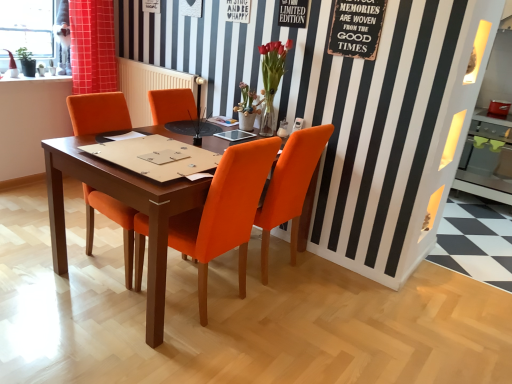
The width and height of the screenshot is (512, 384). What do you see at coordinates (225, 212) in the screenshot? I see `orange fabric chair at center, the 2th chair from the right` at bounding box center [225, 212].

Describe the element at coordinates (99, 113) in the screenshot. I see `orange leather chair at center, acting as the first chair starting from the left` at that location.

Identify the location of orange leather chair at center, acting as the first chair starting from the left. (99, 113).

Describe the element at coordinates (290, 187) in the screenshot. This screenshot has width=512, height=384. I see `orange fabric chair at center, the third chair in the left-to-right sequence` at that location.

What do you see at coordinates (271, 80) in the screenshot? I see `matte glass vase at upper center, which is counted as the 1th flower, starting from the right` at bounding box center [271, 80].

This screenshot has width=512, height=384. Describe the element at coordinates (248, 101) in the screenshot. I see `matte orange vase at center, which ranks as the first flower in left-to-right order` at that location.

Describe the element at coordinates (92, 46) in the screenshot. This screenshot has height=384, width=512. I see `orange fabric curtain at upper left` at that location.

The width and height of the screenshot is (512, 384). What do you see at coordinates (104, 184) in the screenshot?
I see `wooden table at center` at bounding box center [104, 184].

Identify the location of orange fabric chair at center, the 2th chair from the right. This screenshot has width=512, height=384. (225, 212).

Does wooden table at center have a greater height compared to limited edition paper at upper center?

Yes, wooden table at center is taller than limited edition paper at upper center.

From a real-world perspective, does wooden table at center sit lower than limited edition paper at upper center?

Indeed, from a real-world perspective, wooden table at center is positioned beneath limited edition paper at upper center.

Which is less distant, (54, 216) or (293, 25)?

Point (54, 216) is positioned closer to the camera compared to point (293, 25).

From a real-world perspective, is orange fabric chair at center, the 2th chair from the right, over orange fabric curtain at upper left?

No, from a real-world perspective, orange fabric chair at center, the 2th chair from the right, is not above orange fabric curtain at upper left.

Is orange fabric chair at center, the 2th chair from the right, positioned far away from orange fabric curtain at upper left?

orange fabric chair at center, the 2th chair from the right, is far away from orange fabric curtain at upper left.

I want to click on curtain on the left of orange fabric chair at center, the 2th chair from the right, so click(x=92, y=46).

Considering the sizes of orange fabric chair at center, positioned as the 2th chair in left-to-right order, and orange fabric curtain at upper left in the image, is orange fabric chair at center, positioned as the 2th chair in left-to-right order, bigger or smaller than orange fabric curtain at upper left?

Considering their sizes, orange fabric chair at center, positioned as the 2th chair in left-to-right order, takes up more space than orange fabric curtain at upper left.

You are a GUI agent. You are given a task and a screenshot of the screen. Output one action in this format:
    pyautogui.click(x=<x>, y=<y>)
    Task: Click on the curtain located underneath the matte glass vase at upper center, which is counted as the 1th flower, starting from the right (from a real-world perspective)
    The width and height of the screenshot is (512, 384).
    Given the screenshot: What is the action you would take?
    pyautogui.click(x=92, y=46)

From the image's perspective, is orange fabric curtain at upper left positioned above or below matte glass vase at upper center, which is counted as the 1th flower, starting from the right?

Clearly, from the image's perspective, orange fabric curtain at upper left is above matte glass vase at upper center, which is counted as the 1th flower, starting from the right.

Is orange fabric curtain at upper left closer to camera compared to matte glass vase at upper center, which is counted as the 1th flower, starting from the right?

No, orange fabric curtain at upper left is further to the viewer.

Looking at this image, is orange leather chair at center, which appears as the 3th chair when viewed from the right, aimed at orange fabric chair at center, the 2th chair from the right?

Yes, orange leather chair at center, which appears as the 3th chair when viewed from the right, is turned towards orange fabric chair at center, the 2th chair from the right.

Which object is more forward, orange leather chair at center, which appears as the 3th chair when viewed from the right, or orange fabric chair at center, the 2th chair from the right?

Positioned in front is orange fabric chair at center, the 2th chair from the right.

Is orange leather chair at center, which appears as the 3th chair when viewed from the right, smaller than orange fabric chair at center, the 2th chair from the right?

No.

Is orange leather chair at center, which appears as the 3th chair when viewed from the right, directly adjacent to orange fabric chair at center, positioned as the 2th chair in left-to-right order?

No, orange leather chair at center, which appears as the 3th chair when viewed from the right, is not in contact with orange fabric chair at center, positioned as the 2th chair in left-to-right order.

From the image's perspective, between matte orange vase at center, which ranks as the first flower in left-to-right order, and orange fabric chair at center, the first chair from the right, who is located below?

orange fabric chair at center, the first chair from the right.

Considering the positions of points (247, 112) and (300, 203), is point (247, 112) farther from camera compared to point (300, 203)?

Yes, point (247, 112) is farther from viewer.

Based on the photo, is matte orange vase at center, which ranks as the first flower in left-to-right order, shorter than orange fabric chair at center, the third chair in the left-to-right sequence?

Indeed, matte orange vase at center, which ranks as the first flower in left-to-right order, has a lesser height compared to orange fabric chair at center, the third chair in the left-to-right sequence.

Is limited edition paper at upper center taller or shorter than matte orange vase at center, which ranks as the first flower in left-to-right order?

In the image, limited edition paper at upper center appears to be shorter than matte orange vase at center, which ranks as the first flower in left-to-right order.

Is limited edition paper at upper center at the right side of matte orange vase at center, which appears as the 2th flower when viewed from the right?

Correct, you'll find limited edition paper at upper center to the right of matte orange vase at center, which appears as the 2th flower when viewed from the right.

Based on the photo, considering the relative sizes of wooden table at center and orange fabric chair at center, the first chair from the right, in the image provided, is wooden table at center shorter than orange fabric chair at center, the first chair from the right,?

Yes.

Does wooden table at center lie in front of orange fabric chair at center, the third chair in the left-to-right sequence?

Yes, wooden table at center is in front of orange fabric chair at center, the third chair in the left-to-right sequence.

Is wooden table at center oriented away from orange fabric chair at center, the first chair from the right?

No.

What's the angular difference between wooden table at center and orange fabric chair at center, the first chair from the right,'s facing directions?

wooden table at center and orange fabric chair at center, the first chair from the right, are facing 89.6 degrees away from each other.

The height and width of the screenshot is (384, 512). In the image, there is a limited edition paper at upper center. In order to click on kitchen & dining room table below it (from a real-world perspective) in this screenshot , I will do `click(104, 184)`.

I want to click on the 3rd chair below the orange fabric curtain at upper left (from the image's perspective), so click(225, 212).

Looking at the image, which one is located closer to limited edition paper at upper center, orange fabric curtain at upper left or matte glass vase at upper center, the second flower from the left?

matte glass vase at upper center, the second flower from the left.

From the picture: Looking at the image, which one is located further to orange fabric chair at center, the first chair from the right, orange fabric chair at center, the 2th chair from the right, or rustic wood signboard at upper right?

Based on the image, rustic wood signboard at upper right appears to be further to orange fabric chair at center, the first chair from the right.

Estimate the real-world distances between objects in this image. Which object is closer to limited edition paper at upper center, orange leather chair at center, which appears as the 3th chair when viewed from the right, or wooden table at center?

wooden table at center is closer to limited edition paper at upper center.

Looking at the image, which one is located further to orange fabric curtain at upper left, orange fabric chair at center, positioned as the 2th chair in left-to-right order, or orange fabric chair at center, the third chair in the left-to-right sequence?

Based on the image, orange fabric chair at center, the third chair in the left-to-right sequence, appears to be further to orange fabric curtain at upper left.

Based on their spatial positions, is wooden table at center or orange fabric curtain at upper left closer to orange fabric chair at center, the first chair from the right?

Among the two, wooden table at center is located nearer to orange fabric chair at center, the first chair from the right.

Estimate the real-world distances between objects in this image. Which object is closer to orange fabric curtain at upper left, orange fabric chair at center, positioned as the 2th chair in left-to-right order, or matte glass vase at upper center, which is counted as the 1th flower, starting from the right?

matte glass vase at upper center, which is counted as the 1th flower, starting from the right, lies closer to orange fabric curtain at upper left than the other object.

From the image, which object appears to be farther from rustic wood signboard at upper right, orange fabric chair at center, the third chair in the left-to-right sequence, or matte glass vase at upper center, the second flower from the left?

Among the two, orange fabric chair at center, the third chair in the left-to-right sequence, is located further to rustic wood signboard at upper right.

Which object lies further to the anchor point wooden table at center, orange fabric chair at center, the 2th chair from the right, or limited edition paper at upper center?

Among the two, limited edition paper at upper center is located further to wooden table at center.

This screenshot has width=512, height=384. Identify the location of bulletin board that lies between limited edition paper at upper center and orange fabric chair at center, the 2th chair from the right, from top to bottom. (356, 28).

Find the location of a particular element. This screenshot has height=384, width=512. kitchen & dining room table situated between orange fabric curtain at upper left and limited edition paper at upper center from left to right is located at coordinates (104, 184).

The height and width of the screenshot is (384, 512). I want to click on kitchen & dining room table located between orange leather chair at center, acting as the first chair starting from the left, and matte glass vase at upper center, which is counted as the 1th flower, starting from the right, in the left-right direction, so click(104, 184).

At what (x,y) coordinates should I click in order to perform the action: click on flower between orange leather chair at center, acting as the first chair starting from the left, and matte glass vase at upper center, the second flower from the left, in the horizontal direction. Please return your answer as a coordinate pair (x, y). Looking at the image, I should click on (248, 101).